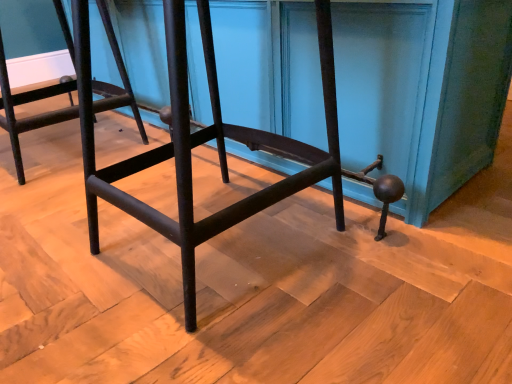
Image resolution: width=512 pixels, height=384 pixels. I want to click on free space below matte black stool at center (from a real-world perspective), so click(228, 240).